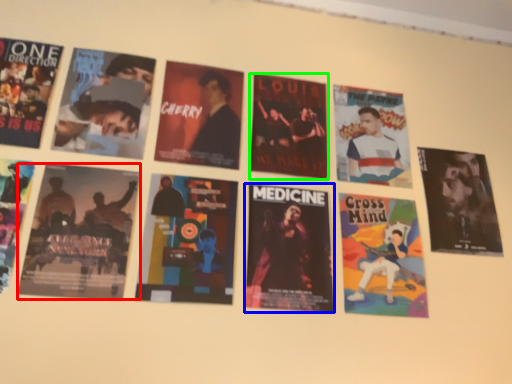
Question: Which object is positioned closest to poster (highlighted by a red box)? Select from poster (highlighted by a blue box) and poster (highlighted by a green box).

Choices:
 (A) poster
 (B) poster

Answer: (A)